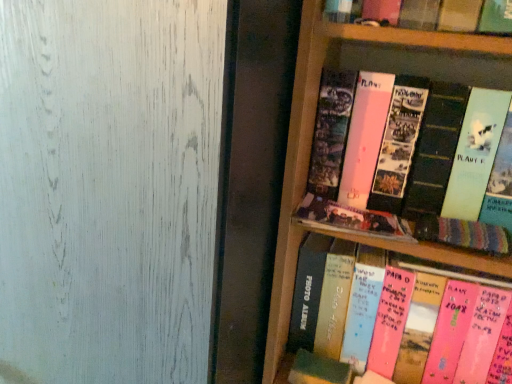
Question: Can you confirm if pink matte photo album at upper right, which is counted as the fourth book, starting from the bottom, is bigger than pink paper photo album at center, the first book in the bottom-to-top sequence?

Choices:
 (A) no
 (B) yes

Answer: (A)

Question: From the image's perspective, would you say pink matte photo album at upper right, acting as the 1th book starting from the top, is positioned over pink paper photo album at center, the first book in the bottom-to-top sequence?

Choices:
 (A) no
 (B) yes

Answer: (B)

Question: Is pink matte photo album at upper right, which is counted as the fourth book, starting from the bottom, in front of pink paper photo album at center, which ranks as the fourth book in top-to-bottom order?

Choices:
 (A) no
 (B) yes

Answer: (B)

Question: Does pink matte photo album at upper right, acting as the 1th book starting from the top, appear on the right side of pink paper photo album at center, the first book in the bottom-to-top sequence?

Choices:
 (A) no
 (B) yes

Answer: (A)

Question: Can you confirm if pink matte photo album at upper right, acting as the 1th book starting from the top, is wider than pink paper photo album at center, the first book in the bottom-to-top sequence?

Choices:
 (A) no
 (B) yes

Answer: (A)

Question: From the image's perspective, is matte black photo album at center, which appears as the second book when viewed from the top, located above or below transparent frosted glass at upper left?

Choices:
 (A) above
 (B) below

Answer: (A)

Question: Considering the positions of matte black photo album at center, marked as the third book in a bottom-to-top arrangement, and transparent frosted glass at upper left in the image, is matte black photo album at center, marked as the third book in a bottom-to-top arrangement, bigger or smaller than transparent frosted glass at upper left?

Choices:
 (A) big
 (B) small

Answer: (B)

Question: Looking at their shapes, would you say matte black photo album at center, marked as the third book in a bottom-to-top arrangement, is wider or thinner than transparent frosted glass at upper left?

Choices:
 (A) wide
 (B) thin

Answer: (B)

Question: Considering the positions of point (305, 210) and point (1, 144), is point (305, 210) closer or farther from the camera than point (1, 144)?

Choices:
 (A) farther
 (B) closer

Answer: (A)

Question: Choose the correct answer: Is matte black photo album at center, which appears as the second book when viewed from the top, inside pink paper photo album at center, the first book in the bottom-to-top sequence, or outside it?

Choices:
 (A) inside
 (B) outside

Answer: (B)

Question: Is matte black photo album at center, which appears as the second book when viewed from the top, taller or shorter than pink paper photo album at center, the first book in the bottom-to-top sequence?

Choices:
 (A) tall
 (B) short

Answer: (B)

Question: Considering the positions of matte black photo album at center, which appears as the second book when viewed from the top, and pink paper photo album at center, the first book in the bottom-to-top sequence, in the image, is matte black photo album at center, which appears as the second book when viewed from the top, bigger or smaller than pink paper photo album at center, the first book in the bottom-to-top sequence,?

Choices:
 (A) small
 (B) big

Answer: (A)

Question: Is point (313, 215) positioned closer to the camera than point (417, 279)?

Choices:
 (A) closer
 (B) farther

Answer: (A)

Question: Considering the positions of pink matte photo album at upper right, which is counted as the fourth book, starting from the bottom, and knitted fabric book at right, which is the third book in top-to-bottom order, in the image, is pink matte photo album at upper right, which is counted as the fourth book, starting from the bottom, taller or shorter than knitted fabric book at right, which is the third book in top-to-bottom order,?

Choices:
 (A) short
 (B) tall

Answer: (B)

Question: Is pink matte photo album at upper right, acting as the 1th book starting from the top, in front of or behind knitted fabric book at right, which is the third book in top-to-bottom order, in the image?

Choices:
 (A) front
 (B) behind

Answer: (A)